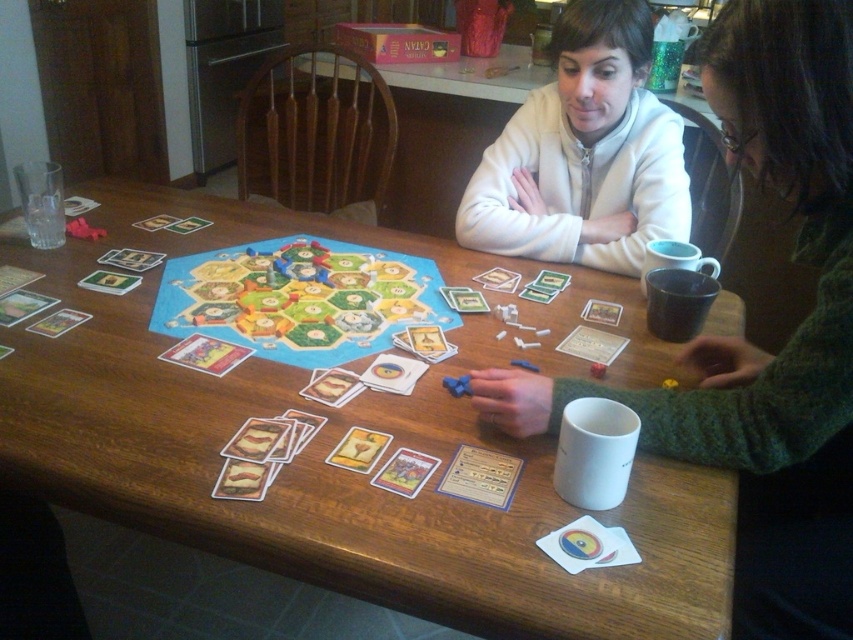
Question: Among these objects, which one is farthest from the camera?

Choices:
 (A) wooden table at center
 (B) wooden table at upper center

Answer: (B)

Question: Observing the image, what is the correct spatial positioning of wooden table at center in reference to green textured sweater at upper right?

Choices:
 (A) below
 (B) above

Answer: (B)

Question: Which point is closer to the camera?

Choices:
 (A) wooden table at center
 (B) green textured sweater at upper right
 (C) white fleece sweater at upper center

Answer: (A)

Question: Does green textured sweater at upper right have a larger size compared to wooden table at upper center?

Choices:
 (A) yes
 (B) no

Answer: (B)

Question: Where is green textured sweater at upper right located in relation to wooden table at upper center in the image?

Choices:
 (A) right
 (B) left

Answer: (A)

Question: Which of the following is the closest to the observer?

Choices:
 (A) wooden table at center
 (B) white fleece sweater at upper center
 (C) wooden table at upper center
 (D) green textured sweater at upper right

Answer: (A)